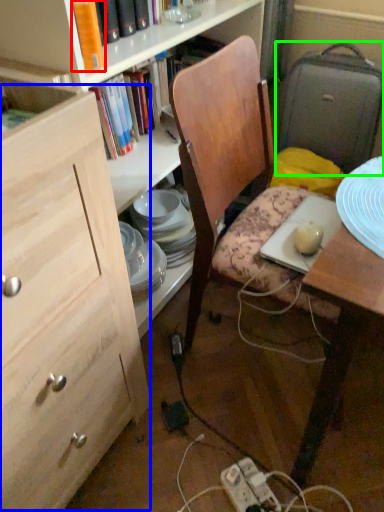
Question: Considering the real-world distances, which object is farthest from book (highlighted by a red box)? cabinetry (highlighted by a blue box) or suitcase (highlighted by a green box)?

Choices:
 (A) cabinetry
 (B) suitcase

Answer: (B)